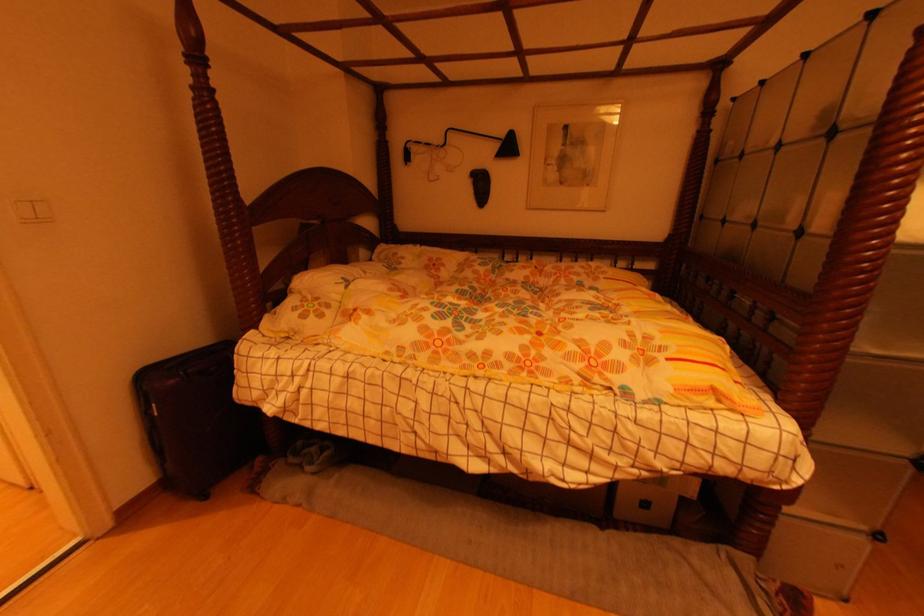
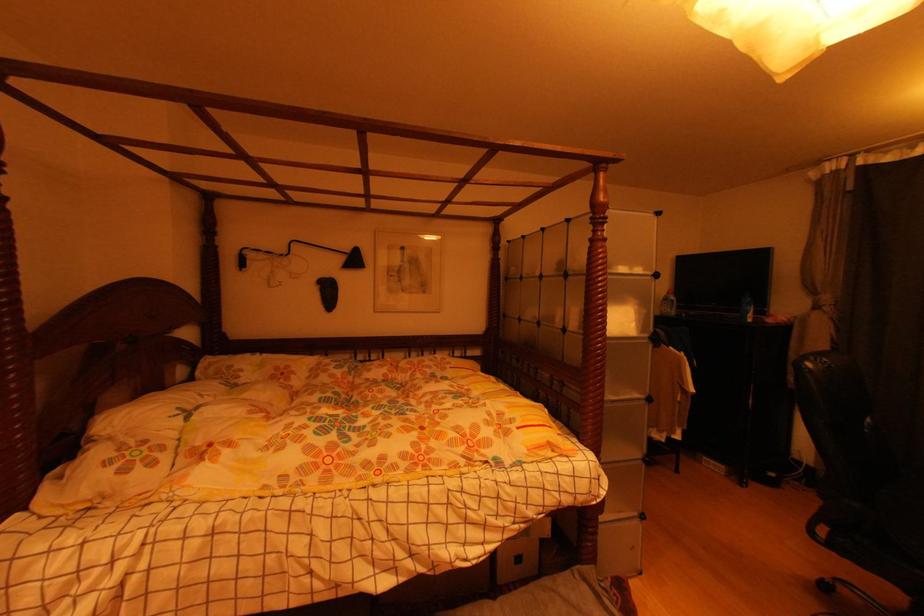
The point at (501, 148) is marked in the first image. Where is the corresponding point in the second image?

(346, 261)